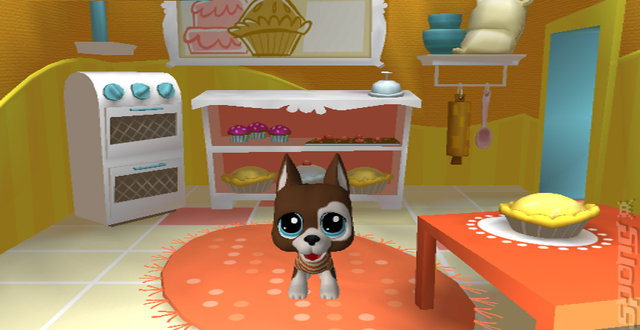
The width and height of the screenshot is (640, 330). Identify the location of orange table leg. (427, 280).